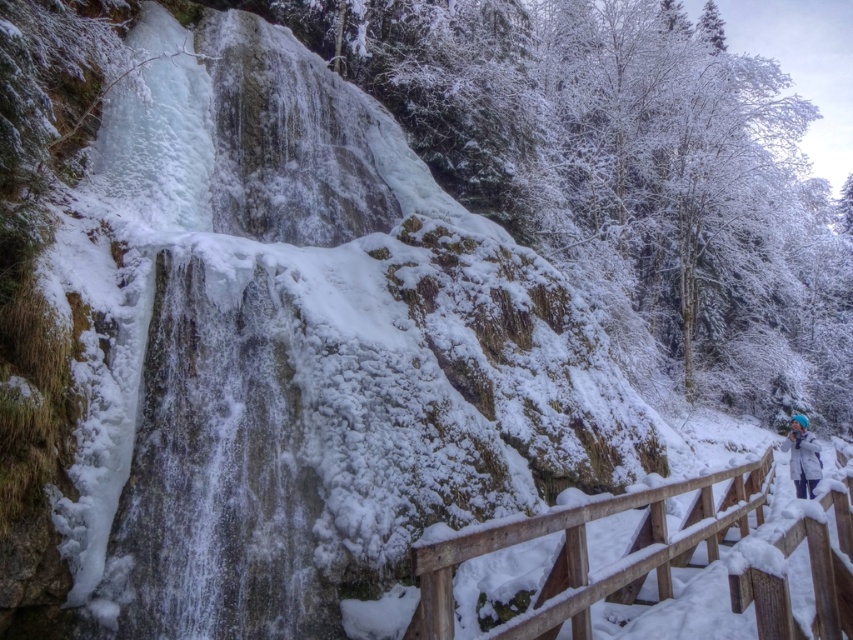
You are standing at the bottom of the waterfall and notice a wooden rail at lower right and a white fleece jacket at lower right. Which object is closer to your left side?

The wooden rail at lower right is closer to your left side because it is positioned to the left of the white fleece jacket at lower right.

You are a hiker standing at the edge of the cliff near the wooden rail at lower right and the white fleece jacket at lower right. You want to move your backpack to a spot where it won

The wooden rail at lower right occupies less space than the white fleece jacket at lower right, so you can place your backpack next to the wooden rail at lower right since it has more available space.

You are standing at the base of the cliff looking up at the frozen waterfall. There are two points marked on the waterfall. The first point is at coordinates point (x=763, y=481) and the second is at point (x=802, y=424). Which point is closer to you?

Point (x=763, y=481) is in front of point (x=802, y=424), so it is closer to you.